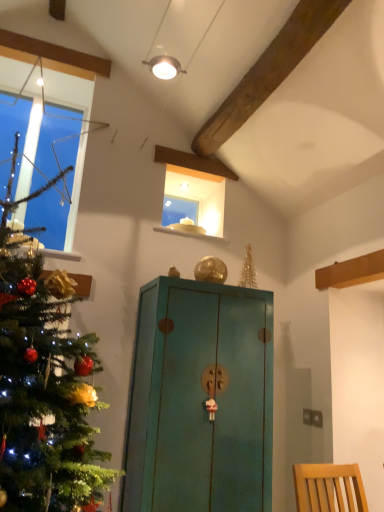
The image size is (384, 512). Describe the element at coordinates (68, 89) in the screenshot. I see `clear glass window at left` at that location.

The image size is (384, 512). I want to click on clear glass window at left, so click(68, 89).

Measure the distance between clear glass window at left and camera.

clear glass window at left and camera are 2.52 meters apart.

What is the approximate height of teal painted wood cabinet at center?

teal painted wood cabinet at center is 4.15 feet in height.

Where is `teal painted wood cabinet at center`? teal painted wood cabinet at center is located at coordinates (200, 399).

Describe the element at coordinates (200, 399) in the screenshot. I see `teal painted wood cabinet at center` at that location.

Image resolution: width=384 pixels, height=512 pixels. Identify the location of clear glass window at left. (68, 89).

Visually, is teal painted wood cabinet at center positioned to the left or to the right of clear glass window at left?

From the image, it's evident that teal painted wood cabinet at center is to the right of clear glass window at left.

Considering the positions of objects teal painted wood cabinet at center and clear glass window at left in the image provided, who is in front, teal painted wood cabinet at center or clear glass window at left?

teal painted wood cabinet at center.

Does point (267, 476) come behind point (88, 72)?

No, it is not.

From the image's perspective, between teal painted wood cabinet at center and clear glass window at left, which one is located above?

clear glass window at left, from the image's perspective.

From a real-world perspective, relative to clear glass window at left, is teal painted wood cabinet at center vertically above or below?

Clearly, from a real-world perspective, teal painted wood cabinet at center is below clear glass window at left.

Looking at their sizes, would you say teal painted wood cabinet at center is wider or thinner than clear glass window at left?

In the image, teal painted wood cabinet at center appears to be wider than clear glass window at left.

Who is shorter, teal painted wood cabinet at center or clear glass window at left?

clear glass window at left.

Looking at this image, who is bigger, teal painted wood cabinet at center or clear glass window at left?

Bigger between the two is teal painted wood cabinet at center.

From the picture: Is teal painted wood cabinet at center completely or partially outside of clear glass window at left?

Yes, teal painted wood cabinet at center is outside of clear glass window at left.

Are teal painted wood cabinet at center and clear glass window at left located far from each other?

teal painted wood cabinet at center is far away from clear glass window at left.

Is teal painted wood cabinet at center facing towards clear glass window at left?

No, teal painted wood cabinet at center is not aimed at clear glass window at left.

Where is `cabinetry lying in front of the clear glass window at left`? The height and width of the screenshot is (512, 384). cabinetry lying in front of the clear glass window at left is located at coordinates point(200,399).

Between clear glass window at left and teal painted wood cabinet at center, which one appears on the left side from the viewer's perspective?

clear glass window at left.

Relative to teal painted wood cabinet at center, is clear glass window at left in front or behind?

clear glass window at left is behind teal painted wood cabinet at center.

Is point (18, 84) closer to viewer compared to point (208, 426)?

That is False.

From the image's perspective, is clear glass window at left below teal painted wood cabinet at center?

Incorrect, from the image's perspective, clear glass window at left is higher than teal painted wood cabinet at center.

From a real-world perspective, is clear glass window at left on top of teal painted wood cabinet at center?

Indeed, from a real-world perspective, clear glass window at left stands above teal painted wood cabinet at center.

Can you confirm if clear glass window at left is wider than teal painted wood cabinet at center?

A: No.

In terms of height, does clear glass window at left look taller or shorter compared to teal painted wood cabinet at center?

clear glass window at left is shorter than teal painted wood cabinet at center.

Does clear glass window at left have a smaller size compared to teal painted wood cabinet at center?

Indeed, clear glass window at left has a smaller size compared to teal painted wood cabinet at center.

Would you say clear glass window at left contains teal painted wood cabinet at center?

Actually, teal painted wood cabinet at center is outside clear glass window at left.

Is clear glass window at left far from teal painted wood cabinet at center?

Absolutely, clear glass window at left is distant from teal painted wood cabinet at center.

Based on the photo, is clear glass window at left looking in the opposite direction of teal painted wood cabinet at center?

No, clear glass window at left's orientation is not away from teal painted wood cabinet at center.

Image resolution: width=384 pixels, height=512 pixels. In order to click on window above the teal painted wood cabinet at center (from a real-world perspective) in this screenshot , I will do `click(68, 89)`.

You are a GUI agent. You are given a task and a screenshot of the screen. Output one action in this format:
    pyautogui.click(x=<x>, y=<y>)
    Task: Click on the window behind the teal painted wood cabinet at center
    This screenshot has width=384, height=512.
    Given the screenshot: What is the action you would take?
    pyautogui.click(x=68, y=89)

Where is `window above the teal painted wood cabinet at center (from a real-world perspective)`? The height and width of the screenshot is (512, 384). window above the teal painted wood cabinet at center (from a real-world perspective) is located at coordinates (68, 89).